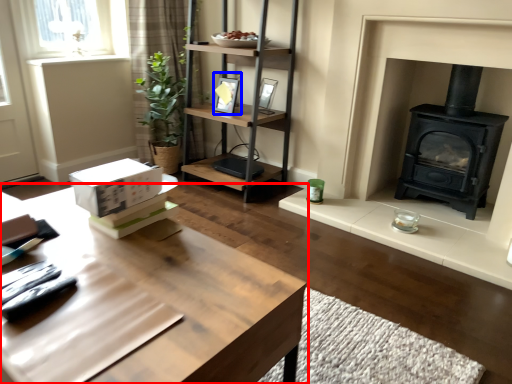
Question: Among these objects, which one is farthest to the camera, table (highlighted by a red box) or picture frame (highlighted by a blue box)?

Choices:
 (A) table
 (B) picture frame

Answer: (B)